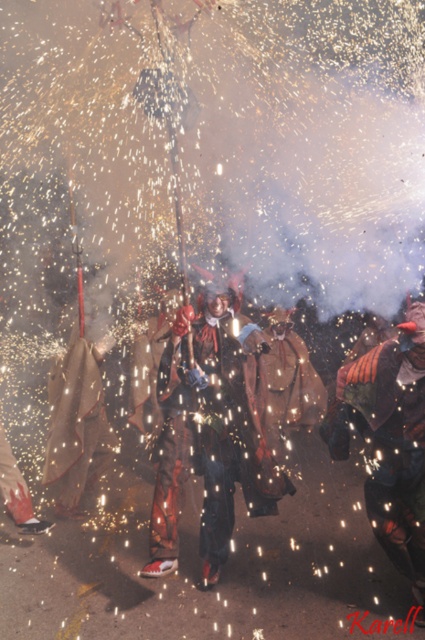
Question: Among these points, which one is farthest from the camera?

Choices:
 (A) (410, 470)
 (B) (226, 509)

Answer: (B)

Question: Is shiny metallic costume at center above velvet orange cape at center?

Choices:
 (A) no
 (B) yes

Answer: (B)

Question: Is shiny metallic costume at center above velvet orange cape at center?

Choices:
 (A) no
 (B) yes

Answer: (B)

Question: Which point appears closest to the camera in this image?

Choices:
 (A) (390, 532)
 (B) (166, 404)

Answer: (A)

Question: Is shiny metallic costume at center to the left of velvet orange cape at center from the viewer's perspective?

Choices:
 (A) yes
 (B) no

Answer: (A)